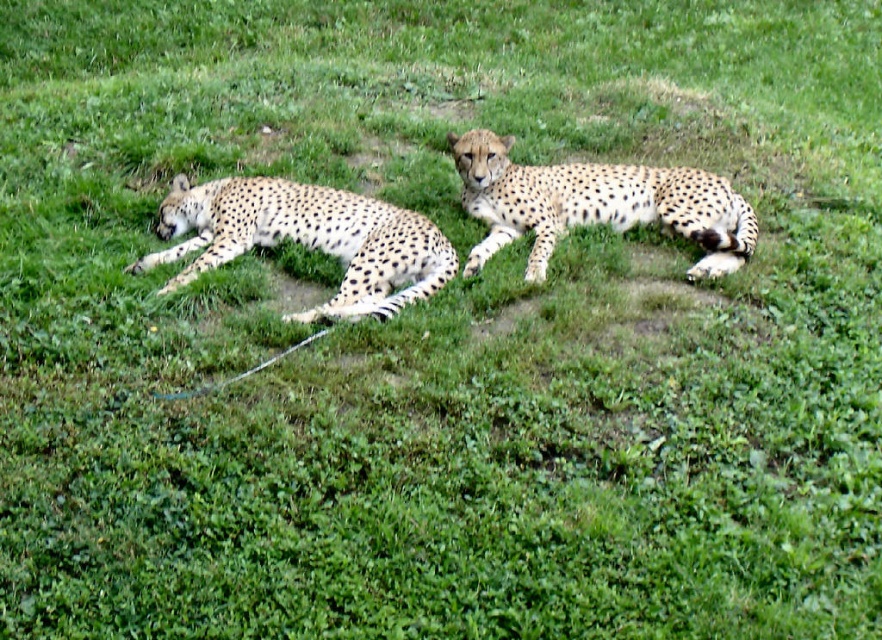
Question: Does spotted fur cheetah at left appear under spotted fur cheetah at center?

Choices:
 (A) no
 (B) yes

Answer: (B)

Question: Does spotted fur cheetah at left come behind spotted fur cheetah at center?

Choices:
 (A) yes
 (B) no

Answer: (B)

Question: Does spotted fur cheetah at left have a larger size compared to spotted fur cheetah at center?

Choices:
 (A) yes
 (B) no

Answer: (A)

Question: Among these objects, which one is nearest to the camera?

Choices:
 (A) spotted fur cheetah at left
 (B) spotted fur cheetah at center

Answer: (A)